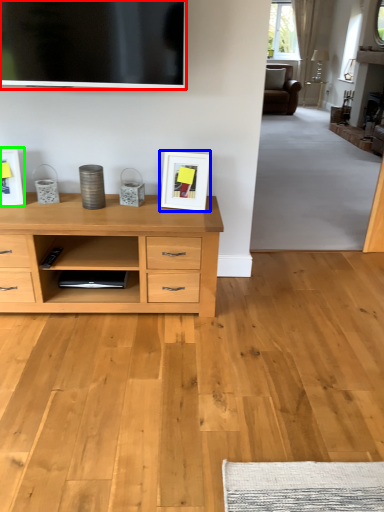
Question: Which object is the closest to the television (highlighted by a red box)? Choose among these: picture frame (highlighted by a blue box) or picture frame (highlighted by a green box).

Choices:
 (A) picture frame
 (B) picture frame

Answer: (A)